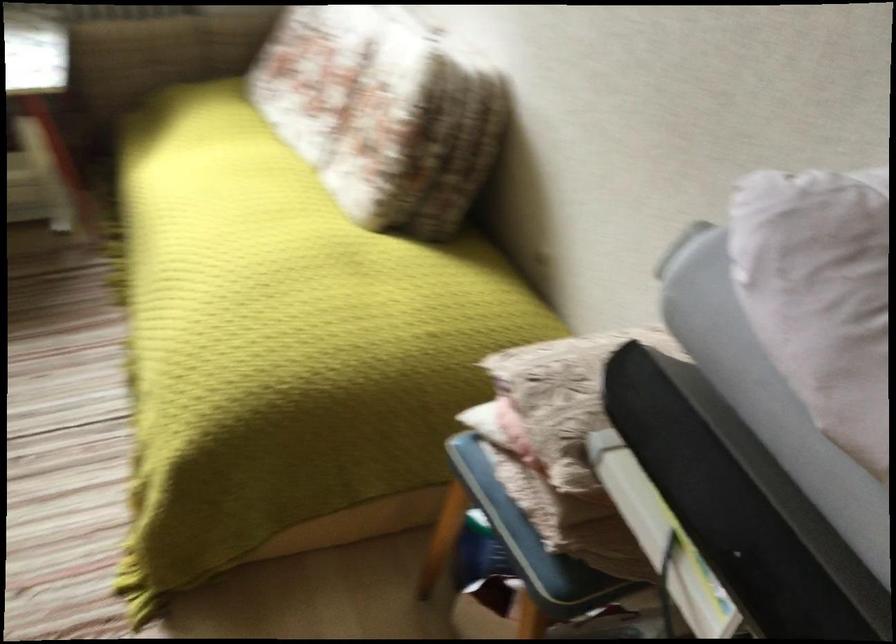
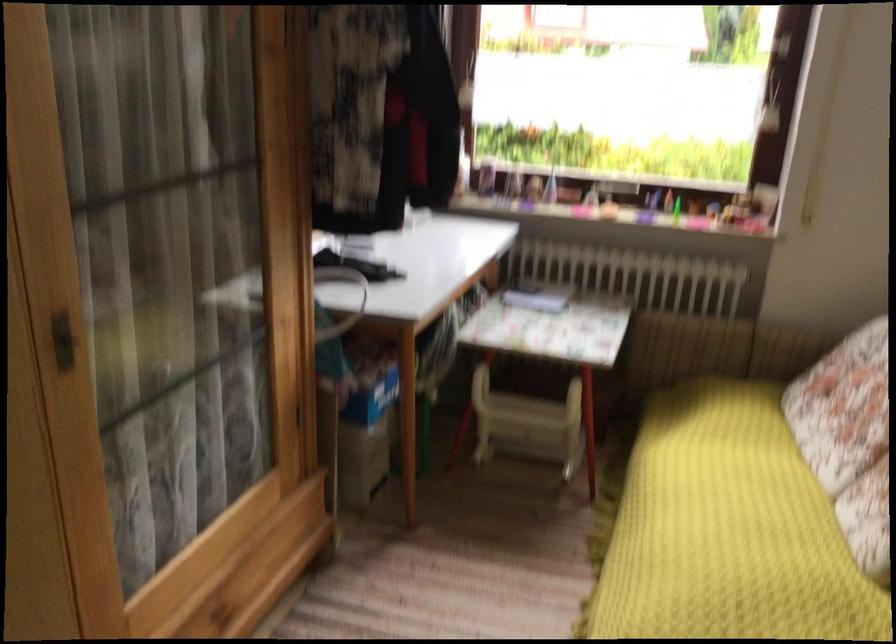
The point at (307,116) is marked in the first image. Where is the corresponding point in the second image?

(849, 439)